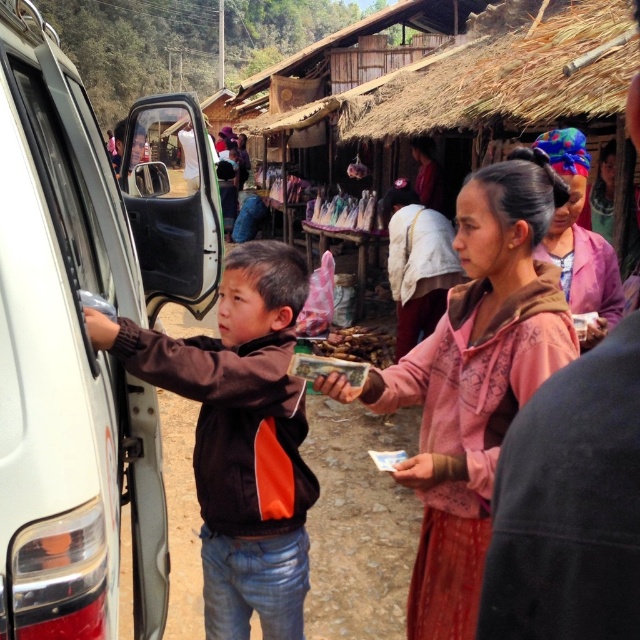
You are a delivery person who needs to park your truck next to the white matte van at left and the pink fabric at center. Since you want to maximize space, which one should you park next to?

The white matte van at left has a larger size compared to the pink fabric at center, so you should park next to the pink fabric at center to maximize space.

You are a delivery person standing at the camera position. You need to load a package into the white matte van at left. Can you reach the van from your current position without moving your feet?

The white matte van at left is 3.80 feet from camera, so yes, you can reach the van from your current position since it is within a short distance.